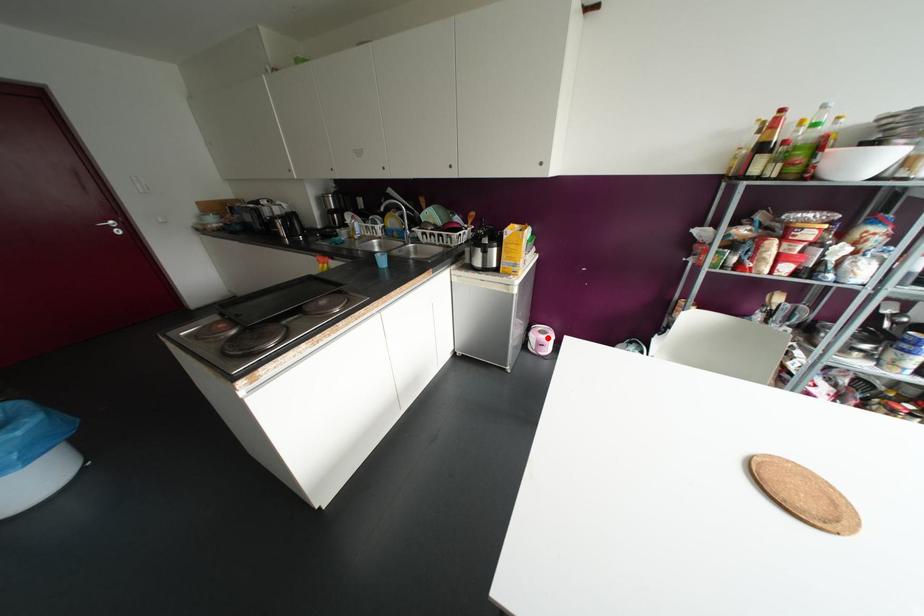
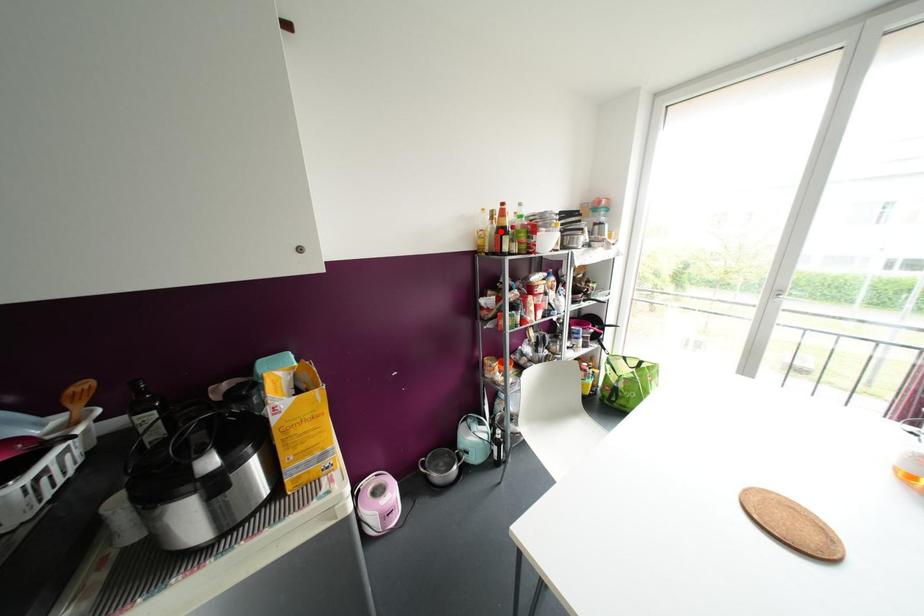
I am providing you with two images of the same scene from different viewpoints. A red point is marked on the first image and another point is marked on the second image. Is the red point in image1 aligned with the point shown in image2?

No